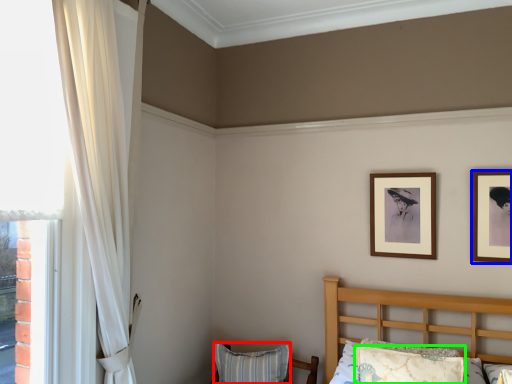
Question: Which object is positioned farthest from pillow (highlighted by a red box)? Select from picture frame (highlighted by a blue box) and pillow (highlighted by a green box).

Choices:
 (A) picture frame
 (B) pillow

Answer: (A)